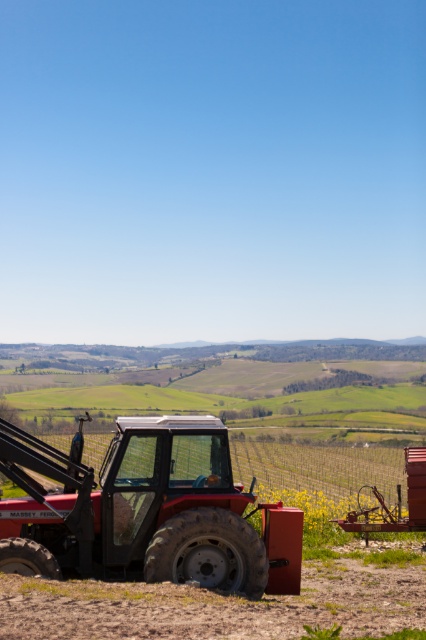
Can you confirm if matte red tractor at lower left is bigger than dull brown dirt at lower right?

Correct, matte red tractor at lower left is larger in size than dull brown dirt at lower right.

Does matte red tractor at lower left come in front of dull brown dirt at lower right?

No, it is not.

The image size is (426, 640). What do you see at coordinates (146, 509) in the screenshot? I see `matte red tractor at lower left` at bounding box center [146, 509].

Identify the location of matte red tractor at lower left. (146, 509).